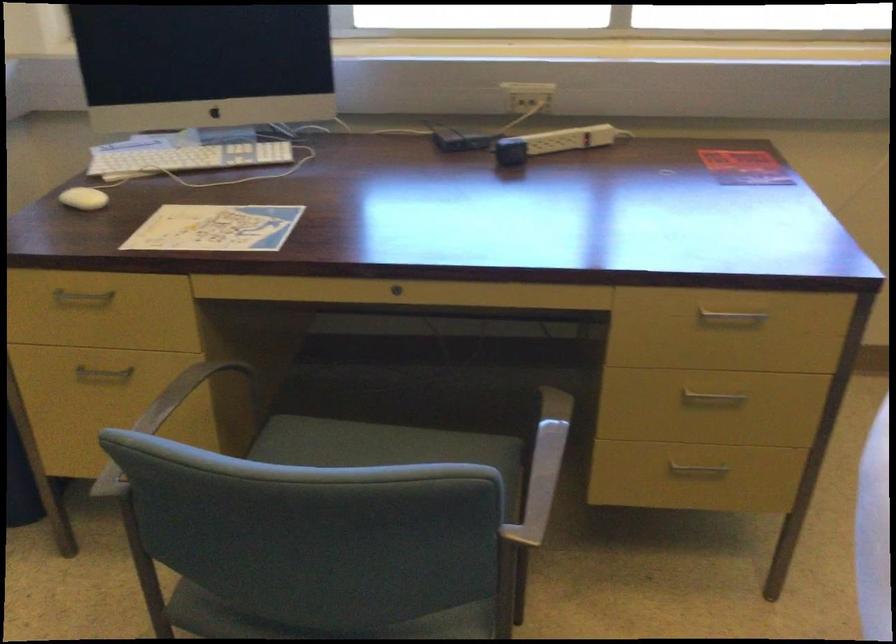
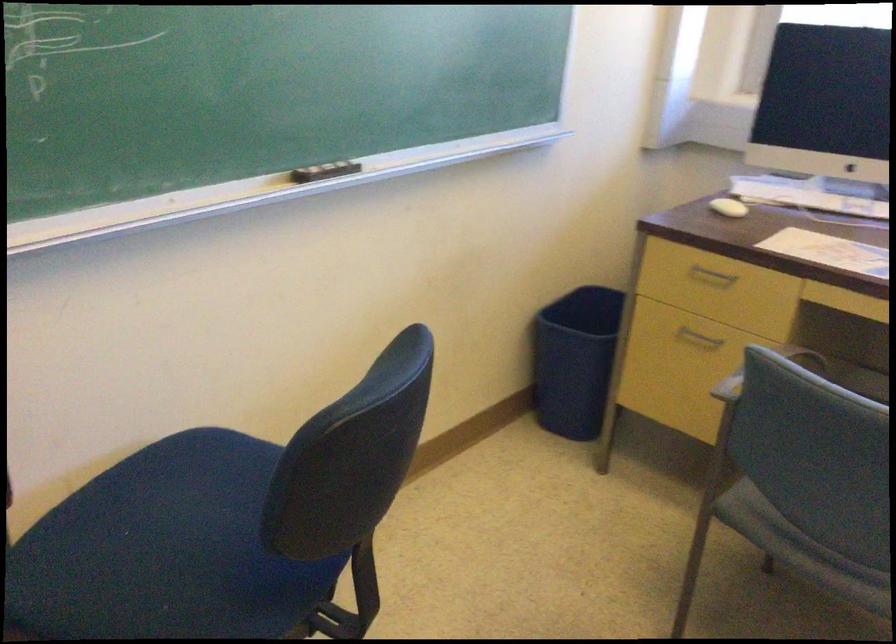
Find the pixel in the second image that matches (78,207) in the first image.

(728, 207)